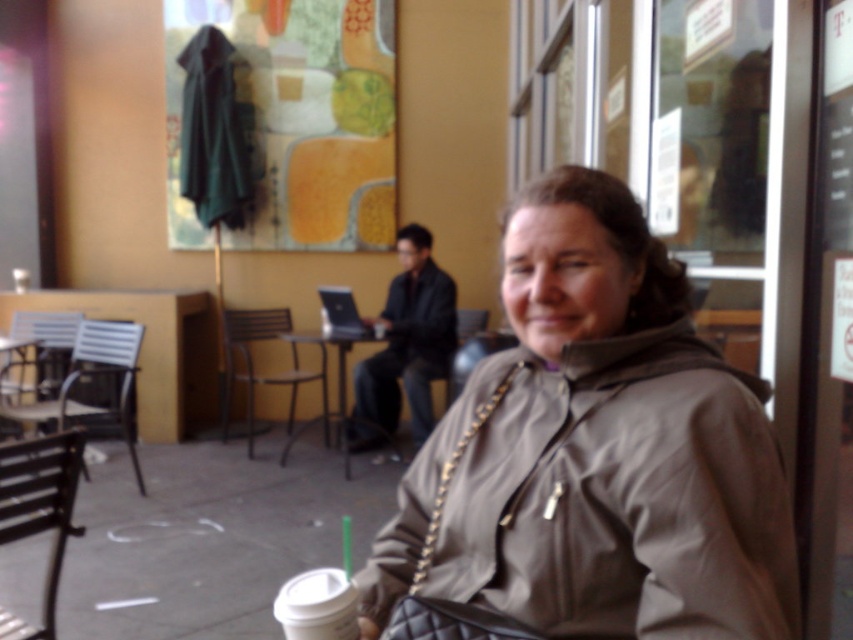
Which is in front, point (619, 380) or point (345, 397)?

Point (619, 380) is in front.

Can you confirm if matte gray jacket at center is smaller than metallic silver table at center?

Indeed, matte gray jacket at center has a smaller size compared to metallic silver table at center.

In order to click on matte gray jacket at center in this screenshot , I will do `click(596, 451)`.

Identify the location of matte gray jacket at center. This screenshot has width=853, height=640. (596, 451).